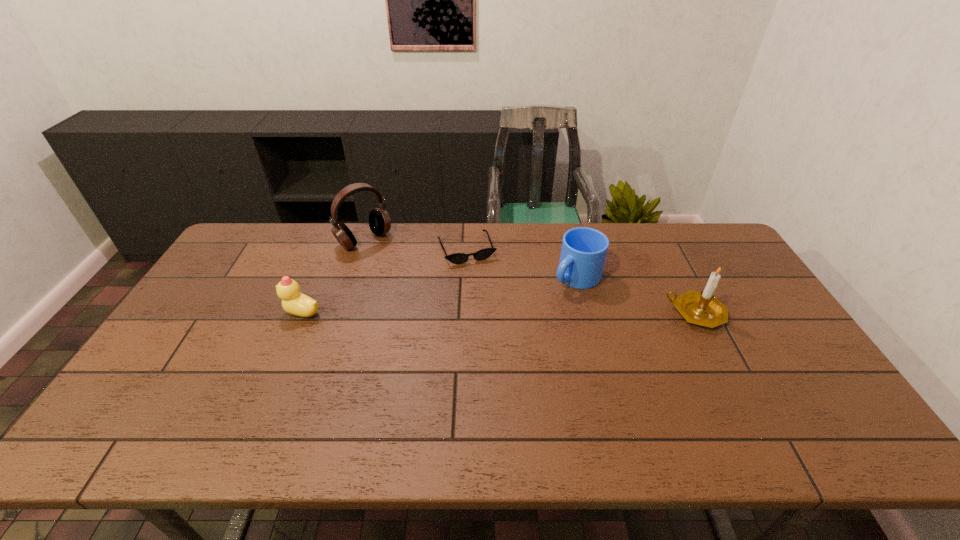
Identify the location of free space on the desktop that is between the duckling and the fourth shortest object and is positioned on the ear pads of the tallest object. pos(443,313).

Locate an element on the screen. The height and width of the screenshot is (540, 960). vacant spot on the desktop that is between the duckling and the rightmost object and is positioned on the side of the second object from right to left with the handle is located at coordinates (532, 313).

Find the location of a particular element. The height and width of the screenshot is (540, 960). free space on the desktop that is between the duckling and the candle holder and is positioned on the front-facing side of the shortest object is located at coordinates (492, 313).